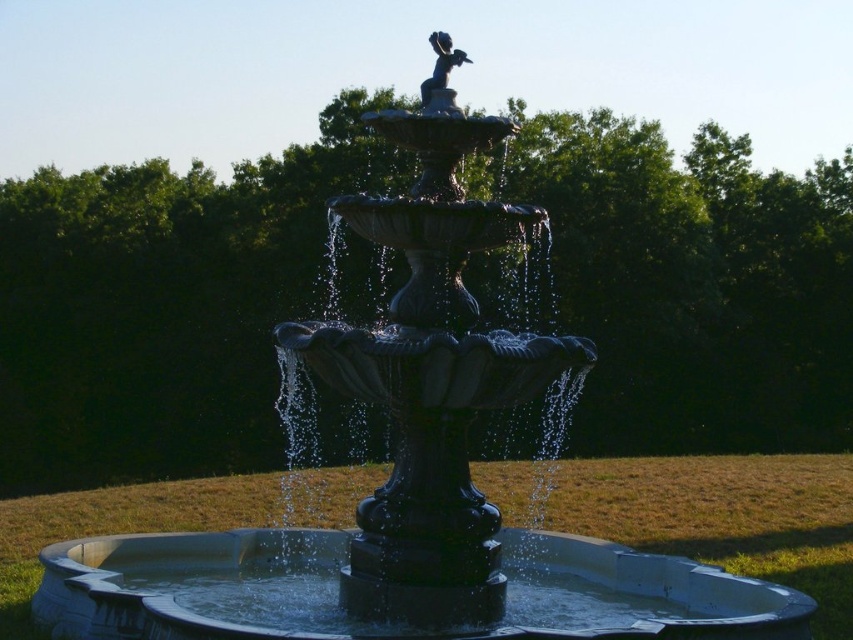
Does point (747, 628) lie in front of point (454, 56)?

That is True.

Which is behind, point (683, 596) or point (442, 77)?

The point (683, 596) is behind.

What are the coordinates of `glossy concrete basin at center` in the screenshot? It's located at (389, 625).

Where is `glossy concrete basin at center`? glossy concrete basin at center is located at coordinates (389, 625).